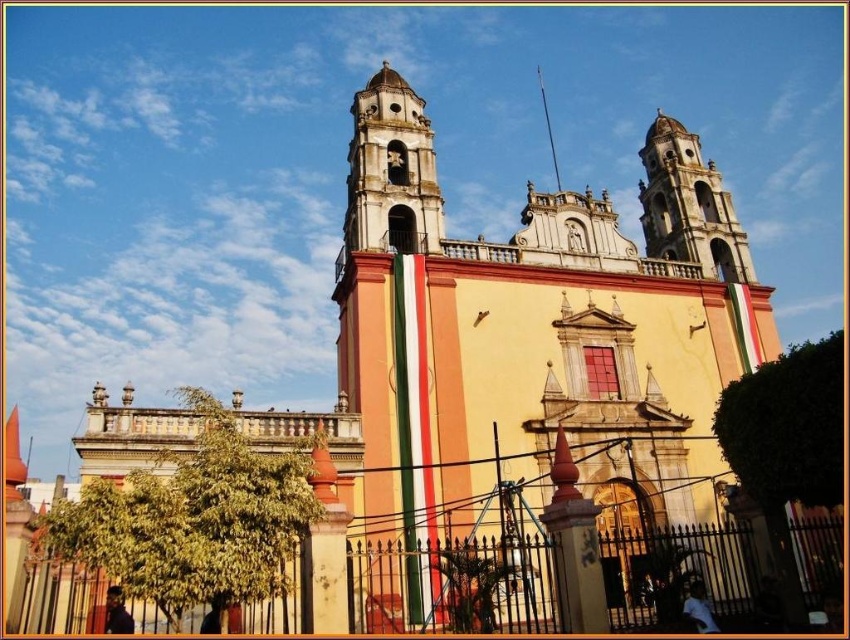
Question: Which object is positioned farthest from the smooth stone bell tower at upper right?

Choices:
 (A) white stone bell tower at center
 (B) iron gate at lower center

Answer: (B)

Question: Can you confirm if white stone bell tower at center is positioned to the right of smooth stone bell tower at upper right?

Choices:
 (A) no
 (B) yes

Answer: (A)

Question: Which of these objects is positioned farthest from the smooth stone bell tower at upper right?

Choices:
 (A) white stone bell tower at center
 (B) iron gate at lower center

Answer: (B)

Question: Does iron gate at lower center have a larger size compared to smooth stone bell tower at upper right?

Choices:
 (A) no
 (B) yes

Answer: (A)

Question: Does white stone bell tower at center lie in front of smooth stone bell tower at upper right?

Choices:
 (A) no
 (B) yes

Answer: (B)

Question: Which point appears farthest from the camera in this image?

Choices:
 (A) [x=748, y=278]
 (B) [x=369, y=196]
 (C) [x=518, y=620]

Answer: (A)